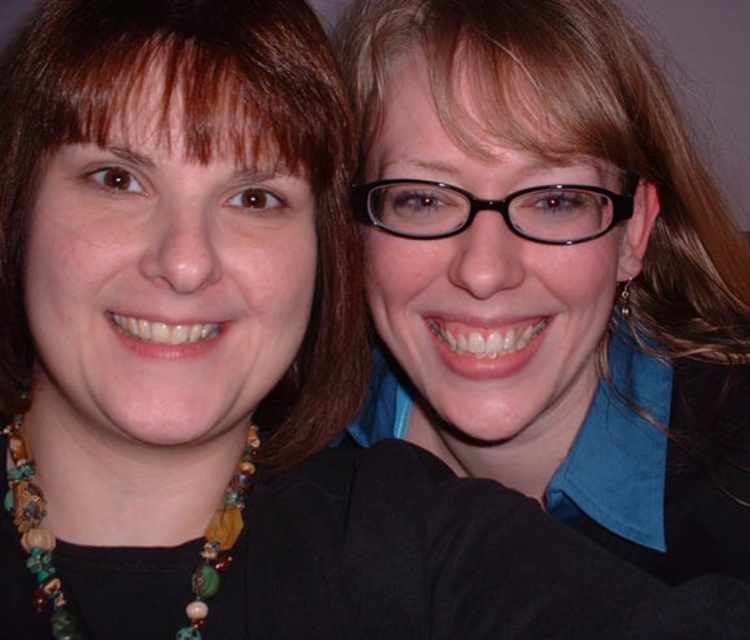
You are a photographer trying to frame a closeup shot of the two people in the image. You need to decide which object, the matte black hair at upper right or the multicolored beaded necklace at lower left, will require more space in your frame due to its size. Which one should you account for?

The matte black hair at upper right requires more space in the frame because its width is larger than the multicolored beaded necklace at lower left.

From the picture: You are a photographer trying to adjust the lighting for a portrait. You notice a point marked at coordinates (525, 225) in the image. What object does this point correspond to?

The point at (525, 225) corresponds to the matte black hair at upper right.

You are a photographer trying to adjust the lighting for a photo shoot. You need to place a spotlight exactly at the location of the matte black hair at upper right. According to the image coordinates, where should you position the spotlight?

The matte black hair at upper right is located at coordinates point (525, 225), so you should position the spotlight at point (525, 225).